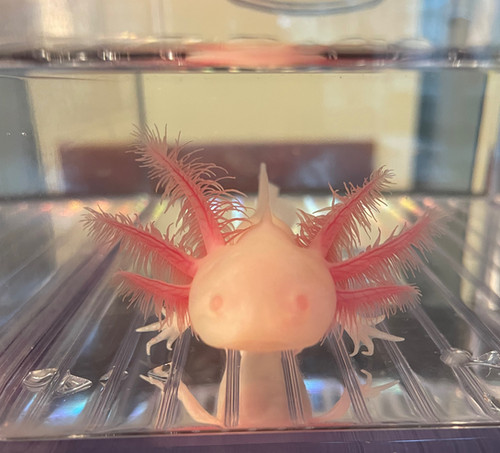
Identify the location of doorway. (455, 138), (273, 202).